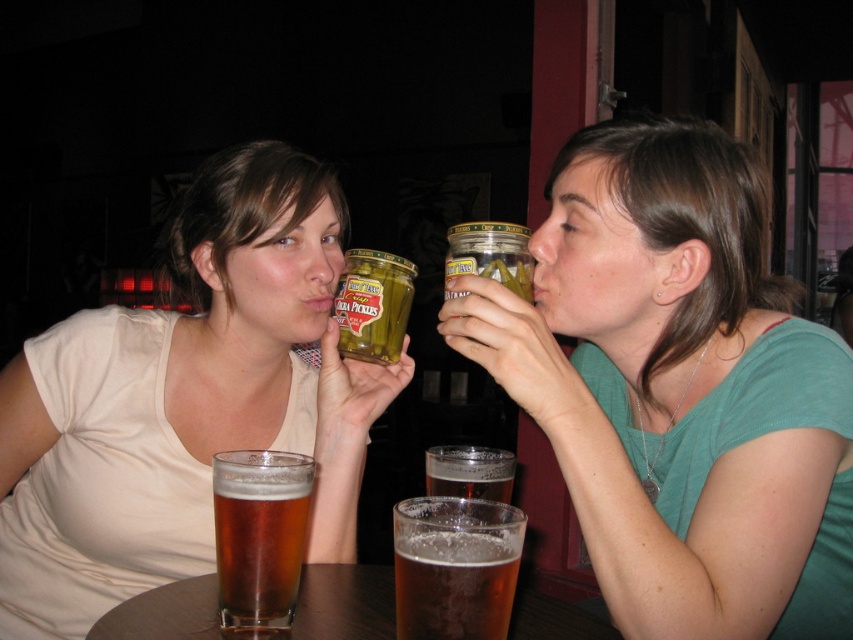
Consider the image. Does translucent glass table at center have a larger size compared to green glass jar at center?

Yes.

Which is above, translucent glass table at center or green glass jar at center?

green glass jar at center is above.

Is point (376, 602) farther from viewer compared to point (344, 326)?

No, (376, 602) is in front of (344, 326).

Locate an element on the screen. This screenshot has height=640, width=853. translucent glass table at center is located at coordinates (345, 602).

Does translucent glass table at center have a greater height compared to brown translucent glass at center?

No.

Who is taller, translucent glass table at center or brown translucent glass at center?

Standing taller between the two is brown translucent glass at center.

I want to click on translucent glass table at center, so click(x=345, y=602).

The image size is (853, 640). Find the location of `translucent glass table at center`. translucent glass table at center is located at coordinates (345, 602).

Can you confirm if green matte jar at upper center is smaller than brown translucent glass at center?

Incorrect, green matte jar at upper center is not smaller in size than brown translucent glass at center.

Is green matte jar at upper center shorter than brown translucent glass at center?

No, green matte jar at upper center is not shorter than brown translucent glass at center.

Is point (679, 173) behind point (219, 604)?

Yes, point (679, 173) is farther from viewer.

This screenshot has width=853, height=640. Identify the location of green matte jar at upper center. (677, 388).